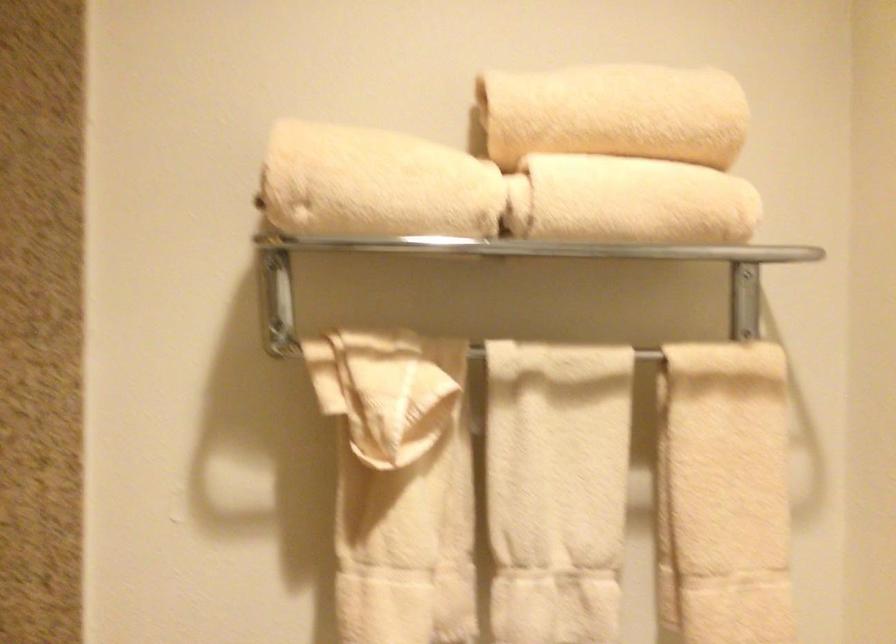
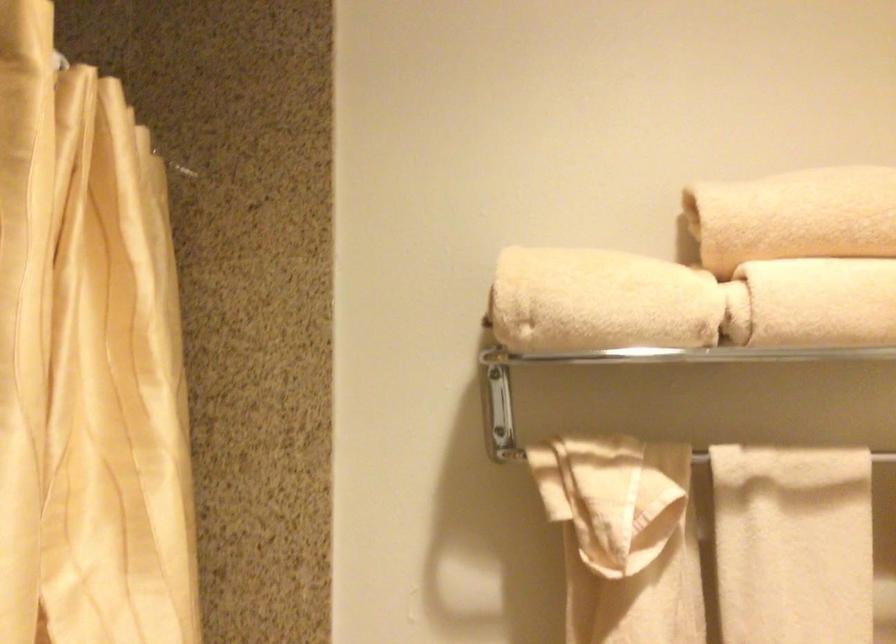
In the second image, find the point that corresponds to [590,196] in the first image.

(814, 301)